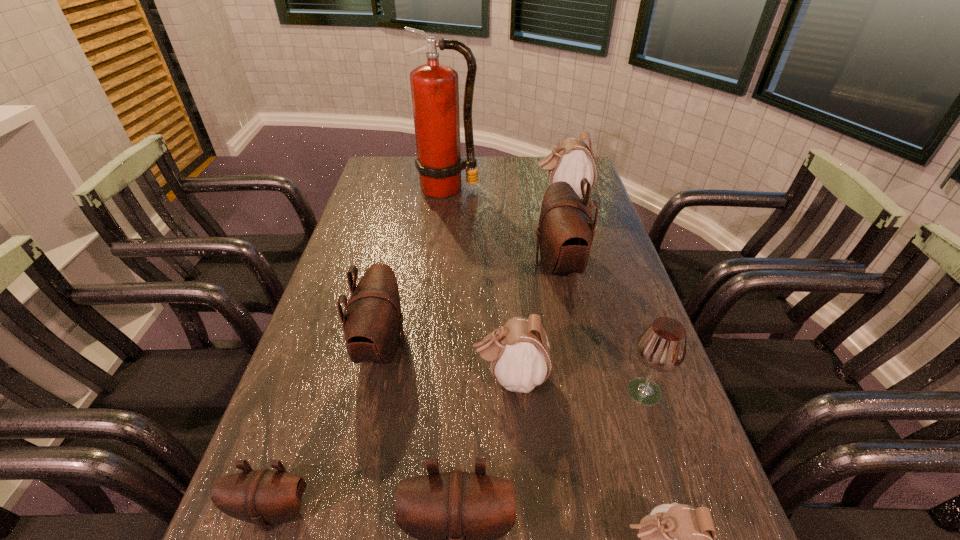
Point out which white pouch is positioned as the third nearest to the tallest object. Please provide its 2D coordinates. Your answer should be formatted as a tuple, i.e. [(x, y)], where the tuple contains the x and y coordinates of a point satisfying the conditions above.

[(676, 539)]

Locate an element on the screen. Image resolution: width=960 pixels, height=540 pixels. blank space that satisfies the following two spatial constraints: 1. with the flap open on the biggest brown pouch; 2. on the right side of the wineglass is located at coordinates (585, 392).